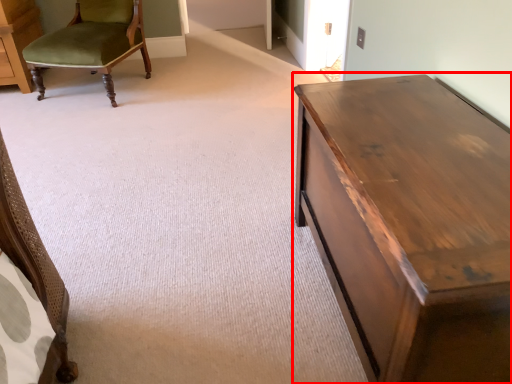
Question: Considering the relative positions of table (annotated by the red box) and chair in the image provided, where is table (annotated by the red box) located with respect to the staircase?

Choices:
 (A) left
 (B) right

Answer: (B)